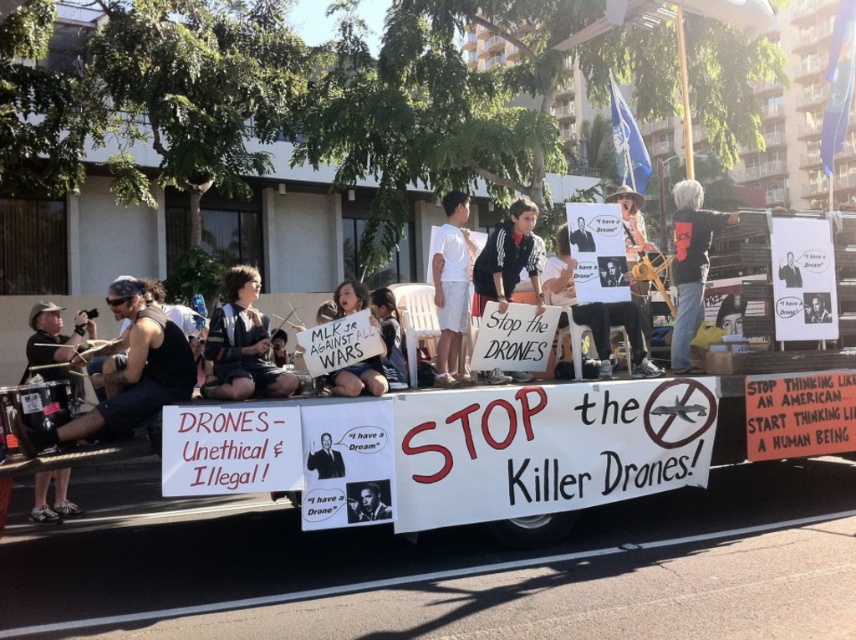
Question: Is matte black drum set at left above smooth black suit at center?

Choices:
 (A) yes
 (B) no

Answer: (B)

Question: Does matte black drum set at left appear on the left side of smooth black suit at center?

Choices:
 (A) no
 (B) yes

Answer: (B)

Question: Does dark blue uniform at center appear under white cotton shorts at center?

Choices:
 (A) no
 (B) yes

Answer: (B)

Question: Which is farther from the black adidas tracksuit at center?

Choices:
 (A) white cotton shorts at center
 (B) black glossy poster at center
 (C) white paper sign at center
 (D) matte black drum set at left

Answer: (D)

Question: Among these points, which one is farthest from the camera?

Choices:
 (A) (363, 515)
 (B) (438, 275)
 (C) (601, 314)
 (D) (337, 454)

Answer: (B)

Question: Among these points, which one is nearest to the camera?

Choices:
 (A) (437, 269)
 (B) (364, 515)

Answer: (B)